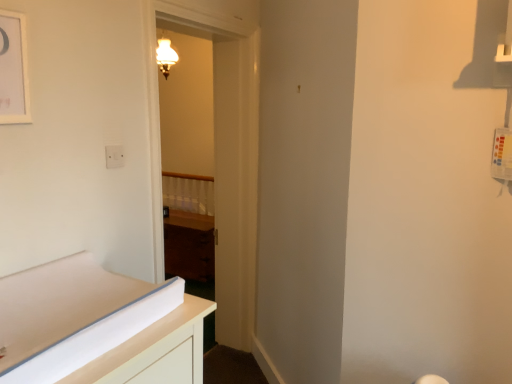
Question: Does white matte picture frame at upper left come in front of wooden door at center?

Choices:
 (A) no
 (B) yes

Answer: (B)

Question: From a real-world perspective, is white matte picture frame at upper left positioned under wooden door at center based on gravity?

Choices:
 (A) no
 (B) yes

Answer: (A)

Question: Are white matte picture frame at upper left and wooden door at center beside each other?

Choices:
 (A) yes
 (B) no

Answer: (B)

Question: Does white matte picture frame at upper left have a larger size compared to wooden door at center?

Choices:
 (A) no
 (B) yes

Answer: (A)

Question: From a real-world perspective, does white matte picture frame at upper left stand above wooden door at center?

Choices:
 (A) no
 (B) yes

Answer: (B)

Question: In terms of size, does wooden at center appear bigger or smaller than dark wood cabinet at center?

Choices:
 (A) big
 (B) small

Answer: (B)

Question: From their relative heights in the image, would you say wooden at center is taller or shorter than dark wood cabinet at center?

Choices:
 (A) tall
 (B) short

Answer: (B)

Question: Considering the positions of point (166, 178) and point (205, 238), is point (166, 178) closer or farther from the camera than point (205, 238)?

Choices:
 (A) farther
 (B) closer

Answer: (A)

Question: From the image's perspective, is wooden at center located above or below dark wood cabinet at center?

Choices:
 (A) below
 (B) above

Answer: (B)

Question: From a real-world perspective, is matte brass sconce at upper center physically located above or below white matte picture frame at upper left?

Choices:
 (A) above
 (B) below

Answer: (A)

Question: In terms of width, does matte brass sconce at upper center look wider or thinner when compared to white matte picture frame at upper left?

Choices:
 (A) thin
 (B) wide

Answer: (B)

Question: Would you say matte brass sconce at upper center is to the left or to the right of white matte picture frame at upper left in the picture?

Choices:
 (A) right
 (B) left

Answer: (B)

Question: Looking at the image, does matte brass sconce at upper center seem bigger or smaller compared to white matte picture frame at upper left?

Choices:
 (A) big
 (B) small

Answer: (A)

Question: From the image's perspective, relative to white matte picture frame at upper left, is white plastic electric outlet at upper left above or below?

Choices:
 (A) below
 (B) above

Answer: (A)

Question: Is white plastic electric outlet at upper left taller or shorter than white matte picture frame at upper left?

Choices:
 (A) tall
 (B) short

Answer: (B)